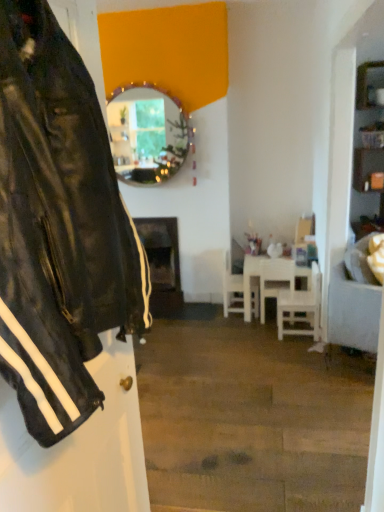
Identify the location of vacant position to the left of white matte chair at center, the first chair from the right. The height and width of the screenshot is (512, 384). (256, 334).